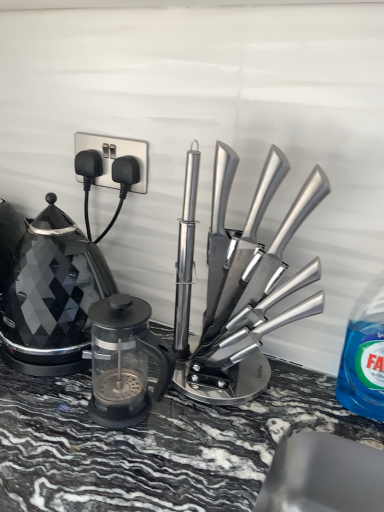
This screenshot has width=384, height=512. What do you see at coordinates (124, 361) in the screenshot?
I see `transparent glass french press at center, which is counted as the second kitchen appliance, starting from the right` at bounding box center [124, 361].

Describe the element at coordinates (247, 286) in the screenshot. This screenshot has height=512, width=384. I see `polished stainless steel knife block at center, positioned as the second kitchen appliance in left-to-right order` at that location.

Identify the location of transparent glass french press at center, which is counted as the second kitchen appliance, starting from the right. This screenshot has height=512, width=384. (124, 361).

From the image's perspective, does black glass kettle at left appear lower than transparent glass french press at center, which is counted as the second kitchen appliance, starting from the right?

Incorrect, from the image's perspective, black glass kettle at left is higher than transparent glass french press at center, which is counted as the second kitchen appliance, starting from the right.

From the picture: Could you tell me if black glass kettle at left is facing transparent glass french press at center, acting as the first kitchen appliance starting from the left?

No.

Is black glass kettle at left surrounding transparent glass french press at center, acting as the first kitchen appliance starting from the left?

No, transparent glass french press at center, acting as the first kitchen appliance starting from the left, is not a part of black glass kettle at left.

Does black glass kettle at left have a smaller size compared to transparent glass french press at center, acting as the first kitchen appliance starting from the left?

No, black glass kettle at left is not smaller than transparent glass french press at center, acting as the first kitchen appliance starting from the left.

Considering their positions, is blue translucent liquid at right located in front of or behind silver metallic plug at upper left?

Clearly, blue translucent liquid at right is in front of silver metallic plug at upper left.

Are blue translucent liquid at right and silver metallic plug at upper left located far from each other?

blue translucent liquid at right is actually quite close to silver metallic plug at upper left.

Is blue translucent liquid at right facing towards silver metallic plug at upper left?

No, blue translucent liquid at right is not oriented towards silver metallic plug at upper left.

Which of these two, blue translucent liquid at right or silver metallic plug at upper left, is bigger?

blue translucent liquid at right.

From a real-world perspective, is silver metallic plug at upper left under transparent glass french press at center, acting as the first kitchen appliance starting from the left?

No.

From the image's perspective, which is below, silver metallic plug at upper left or transparent glass french press at center, which is counted as the second kitchen appliance, starting from the right?

transparent glass french press at center, which is counted as the second kitchen appliance, starting from the right, appears lower in the image.

Does silver metallic plug at upper left turn towards transparent glass french press at center, acting as the first kitchen appliance starting from the left?

No, silver metallic plug at upper left is not facing towards transparent glass french press at center, acting as the first kitchen appliance starting from the left.

In terms of width, does silver metallic plug at upper left look wider or thinner when compared to transparent glass french press at center, which is counted as the second kitchen appliance, starting from the right?

Considering their sizes, silver metallic plug at upper left looks slimmer than transparent glass french press at center, which is counted as the second kitchen appliance, starting from the right.

Is point (247, 306) positioned before point (122, 147)?

That is True.

From a real-world perspective, is polished stainless steel knife block at center, positioned as the second kitchen appliance in left-to-right order, below silver metallic plug at upper left?

Yes, from a real-world perspective, polished stainless steel knife block at center, positioned as the second kitchen appliance in left-to-right order, is below silver metallic plug at upper left.

Is polished stainless steel knife block at center, the first kitchen appliance in the right-to-left sequence, further to the viewer compared to silver metallic plug at upper left?

No, the depth of polished stainless steel knife block at center, the first kitchen appliance in the right-to-left sequence, is less than that of silver metallic plug at upper left.

Is polished stainless steel knife block at center, positioned as the second kitchen appliance in left-to-right order, shorter than silver metallic plug at upper left?

In fact, polished stainless steel knife block at center, positioned as the second kitchen appliance in left-to-right order, may be taller than silver metallic plug at upper left.

Is transparent glass french press at center, which is counted as the second kitchen appliance, starting from the right, smaller than silver metallic plug at upper left?

No.

Based on the photo, from the image's perspective, does transparent glass french press at center, acting as the first kitchen appliance starting from the left, appear higher than silver metallic plug at upper left?

No, from the image's perspective, transparent glass french press at center, acting as the first kitchen appliance starting from the left, is not over silver metallic plug at upper left.

Do you think transparent glass french press at center, acting as the first kitchen appliance starting from the left, is within silver metallic plug at upper left, or outside of it?

transparent glass french press at center, acting as the first kitchen appliance starting from the left, cannot be found inside silver metallic plug at upper left.

From a real-world perspective, which is physically below, transparent glass french press at center, acting as the first kitchen appliance starting from the left, or silver metallic plug at upper left?

transparent glass french press at center, acting as the first kitchen appliance starting from the left, from a real-world perspective.

From a real-world perspective, between transparent glass french press at center, which is counted as the second kitchen appliance, starting from the right, and blue translucent liquid at right, who is vertically lower?

transparent glass french press at center, which is counted as the second kitchen appliance, starting from the right.

From the image's perspective, between transparent glass french press at center, acting as the first kitchen appliance starting from the left, and blue translucent liquid at right, which one is located above?

blue translucent liquid at right is shown above in the image.

Can you confirm if transparent glass french press at center, which is counted as the second kitchen appliance, starting from the right, is thinner than blue translucent liquid at right?

Incorrect, the width of transparent glass french press at center, which is counted as the second kitchen appliance, starting from the right, is not less than that of blue translucent liquid at right.

Which object is positioned more to the right, polished stainless steel knife block at center, positioned as the second kitchen appliance in left-to-right order, or transparent glass french press at center, acting as the first kitchen appliance starting from the left?

polished stainless steel knife block at center, positioned as the second kitchen appliance in left-to-right order.

Considering the sizes of objects polished stainless steel knife block at center, the first kitchen appliance in the right-to-left sequence, and transparent glass french press at center, which is counted as the second kitchen appliance, starting from the right, in the image provided, who is smaller, polished stainless steel knife block at center, the first kitchen appliance in the right-to-left sequence, or transparent glass french press at center, which is counted as the second kitchen appliance, starting from the right,?

transparent glass french press at center, which is counted as the second kitchen appliance, starting from the right, is smaller.

In terms of height, does polished stainless steel knife block at center, positioned as the second kitchen appliance in left-to-right order, look taller or shorter compared to transparent glass french press at center, acting as the first kitchen appliance starting from the left?

polished stainless steel knife block at center, positioned as the second kitchen appliance in left-to-right order, is taller than transparent glass french press at center, acting as the first kitchen appliance starting from the left.

Would you say transparent glass french press at center, acting as the first kitchen appliance starting from the left, is part of polished stainless steel knife block at center, positioned as the second kitchen appliance in left-to-right order,'s contents?

That's incorrect, transparent glass french press at center, acting as the first kitchen appliance starting from the left, is not inside polished stainless steel knife block at center, positioned as the second kitchen appliance in left-to-right order.

At what (x,y) coordinates should I click in order to perform the action: click on kitchen appliance located underneath the black glass kettle at left (from a real-world perspective). Please return your answer as a coordinate pair (x, y). Looking at the image, I should click on (124, 361).

Where is `bottle on the right of silver metallic plug at upper left`? bottle on the right of silver metallic plug at upper left is located at coordinates (364, 355).

When comparing their distances from blue translucent liquid at right, does black glass kettle at left or transparent glass french press at center, which is counted as the second kitchen appliance, starting from the right, seem closer?

The object closer to blue translucent liquid at right is transparent glass french press at center, which is counted as the second kitchen appliance, starting from the right.

Estimate the real-world distances between objects in this image. Which object is further from polished stainless steel knife block at center, positioned as the second kitchen appliance in left-to-right order, blue translucent liquid at right or silver metallic plug at upper left?

silver metallic plug at upper left is further to polished stainless steel knife block at center, positioned as the second kitchen appliance in left-to-right order.

From the image, which object appears to be farther from silver metallic plug at upper left, polished stainless steel knife block at center, the first kitchen appliance in the right-to-left sequence, or blue translucent liquid at right?

blue translucent liquid at right.

Based on their spatial positions, is black glass kettle at left or polished stainless steel knife block at center, positioned as the second kitchen appliance in left-to-right order, closer to transparent glass french press at center, acting as the first kitchen appliance starting from the left?

black glass kettle at left.

Consider the image. When comparing their distances from silver metallic plug at upper left, does polished stainless steel knife block at center, the first kitchen appliance in the right-to-left sequence, or transparent glass french press at center, acting as the first kitchen appliance starting from the left, seem closer?

polished stainless steel knife block at center, the first kitchen appliance in the right-to-left sequence, lies closer to silver metallic plug at upper left than the other object.

Which object lies further to the anchor point transparent glass french press at center, which is counted as the second kitchen appliance, starting from the right, black glass kettle at left or blue translucent liquid at right?

blue translucent liquid at right lies further to transparent glass french press at center, which is counted as the second kitchen appliance, starting from the right, than the other object.

Which object lies further to the anchor point silver metallic plug at upper left, blue translucent liquid at right or polished stainless steel knife block at center, the first kitchen appliance in the right-to-left sequence?

blue translucent liquid at right lies further to silver metallic plug at upper left than the other object.

Based on their spatial positions, is transparent glass french press at center, acting as the first kitchen appliance starting from the left, or blue translucent liquid at right further from silver metallic plug at upper left?

blue translucent liquid at right lies further to silver metallic plug at upper left than the other object.

At what (x,y) coordinates should I click in order to perform the action: click on kitchen appliance between transparent glass french press at center, acting as the first kitchen appliance starting from the left, and blue translucent liquid at right, in the horizontal direction. Please return your answer as a coordinate pair (x, y). Looking at the image, I should click on (247, 286).

Locate an element on the screen. This screenshot has height=512, width=384. kitchen appliance between silver metallic plug at upper left and transparent glass french press at center, acting as the first kitchen appliance starting from the left, from top to bottom is located at coordinates (247, 286).

Image resolution: width=384 pixels, height=512 pixels. I want to click on kitchen appliance located between black glass kettle at left and polished stainless steel knife block at center, positioned as the second kitchen appliance in left-to-right order, in the left-right direction, so click(124, 361).

You are a GUI agent. You are given a task and a screenshot of the screen. Output one action in this format:
    pyautogui.click(x=<x>, y=<y>)
    Task: Click on the electric outlet situated between black glass kettle at left and blue translucent liquid at right from left to right
    
    Given the screenshot: What is the action you would take?
    pyautogui.click(x=115, y=157)